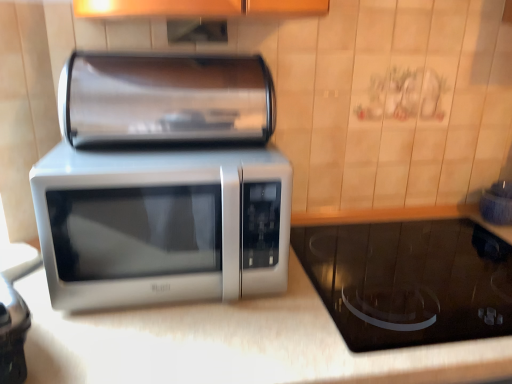
Find the location of a particular element. The image size is (512, 384). free space in front of satin silver microwave at center is located at coordinates (170, 347).